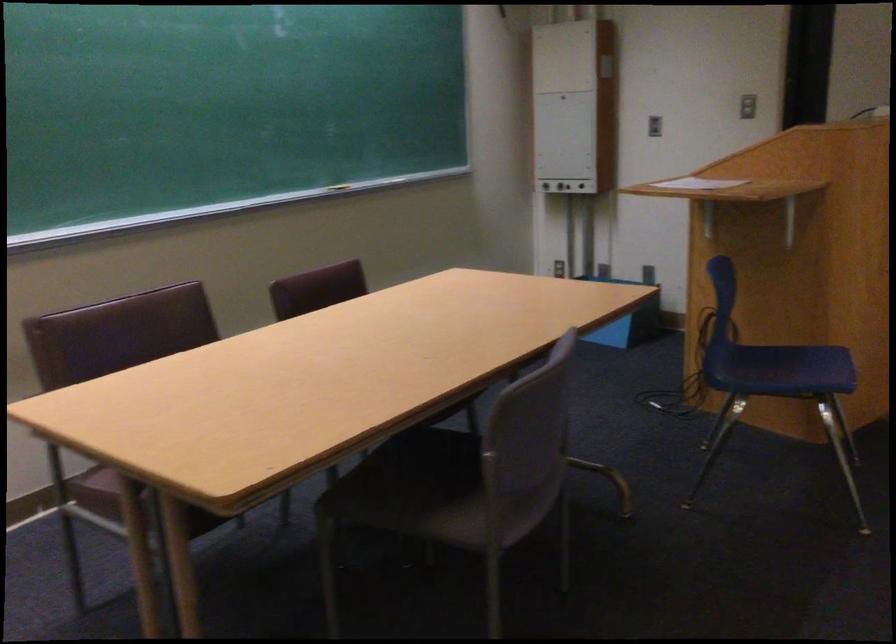
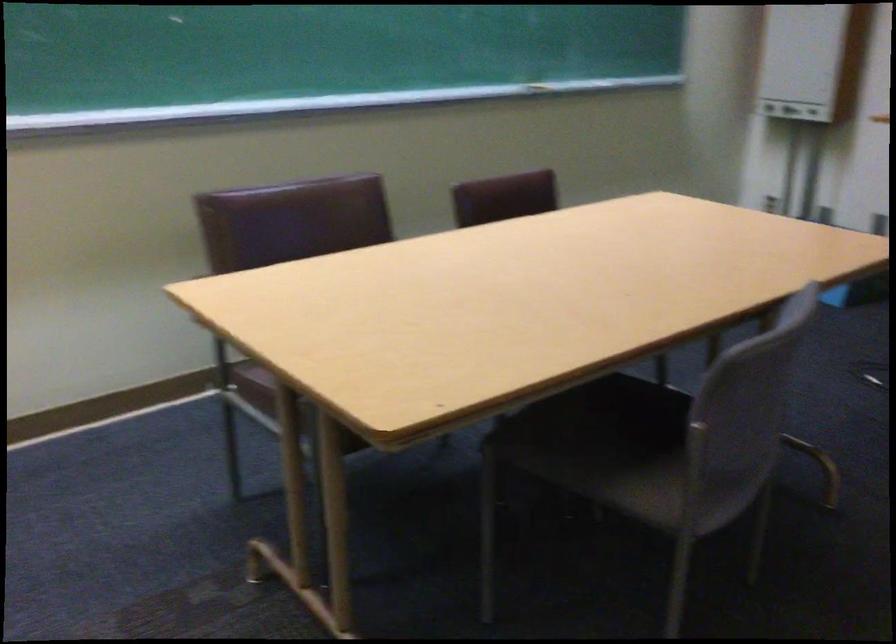
In a continuous first-person perspective shot, in which direction is the camera moving?

The cameraman moved toward left, forward.